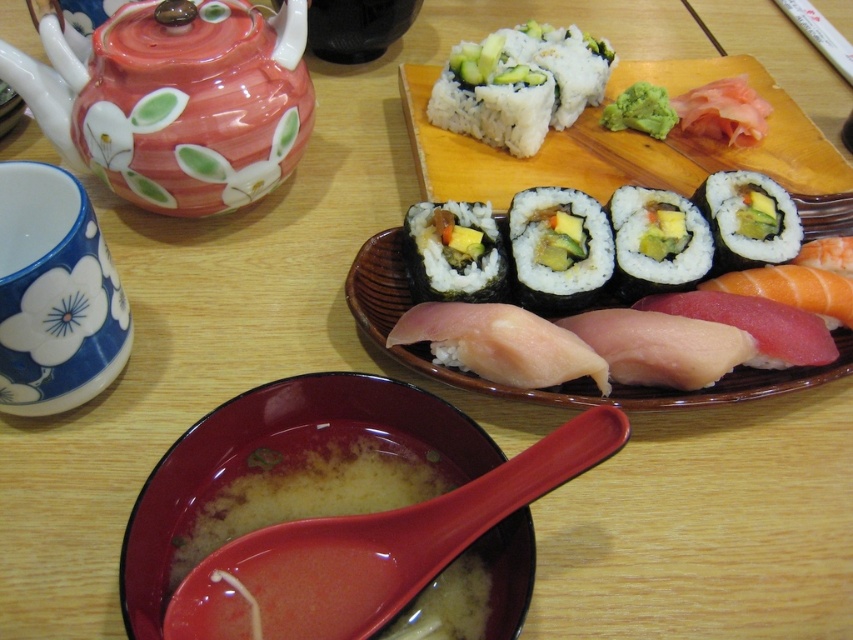
You are a food delivery person who needs to place a hot plate on the table. The table has a wooden surface. You see the point at coordinates (280,461). Is this point on a suitable surface to place the hot plate without damaging the table?

The point at coordinates (280,461) is on the matte ceramic bowl at lower center, which is a suitable surface to place the hot plate without damaging the table because ceramic can withstand heat.

You are a food critic evaluating the presentation of the sushi meal. Which object, the pink raw fish at center or the white paper chopstick at upper right, would you describe as being bigger in size?

The pink raw fish at center is larger in size compared to the white paper chopstick at upper right.

You are a food critic seated at the table. You want to taste the pink raw fish at center but first need to reach for the matte ceramic bowl at lower center. Which object is closer to your hand?

The matte ceramic bowl at lower center is closer to the viewer than the pink raw fish at center, so you can reach it first.